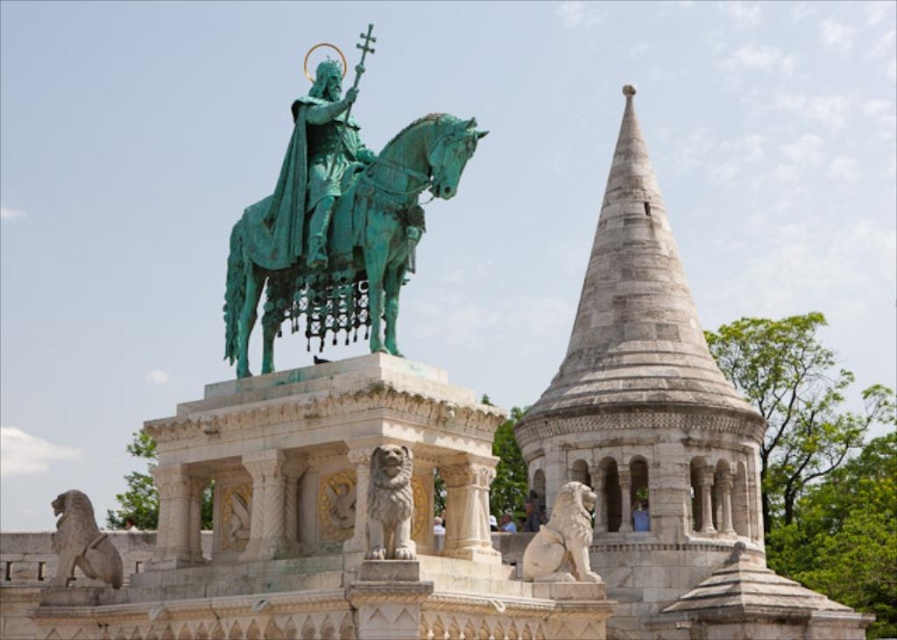
In the scene shown: Is white marble lion at lower right above gray stone lion at lower left?

Yes.

The width and height of the screenshot is (897, 640). Find the location of `white marble lion at lower right`. white marble lion at lower right is located at coordinates (563, 538).

Is point (530, 548) closer to viewer compared to point (72, 522)?

Yes, it is in front of point (72, 522).

Find the location of a particular element. Image resolution: width=897 pixels, height=640 pixels. white marble lion at lower right is located at coordinates (563, 538).

Does point (308, 241) come farther from viewer compared to point (560, 524)?

No.

Is point (295, 241) closer to camera compared to point (588, 557)?

Yes, it is in front of point (588, 557).

The width and height of the screenshot is (897, 640). What are the coordinates of `green patina statue at center` in the screenshot? It's located at pyautogui.click(x=321, y=157).

Is point (229, 257) farther from camera compared to point (319, 216)?

Yes, it is behind point (319, 216).

Who is positioned more to the left, green patina horse at center or green patina statue at center?

From the viewer's perspective, green patina statue at center appears more on the left side.

What do you see at coordinates (345, 244) in the screenshot? Image resolution: width=897 pixels, height=640 pixels. I see `green patina horse at center` at bounding box center [345, 244].

You are a GUI agent. You are given a task and a screenshot of the screen. Output one action in this format:
    pyautogui.click(x=<x>, y=<y>)
    Task: Click on the green patina horse at center
    This screenshot has width=897, height=640.
    Given the screenshot: What is the action you would take?
    pyautogui.click(x=345, y=244)